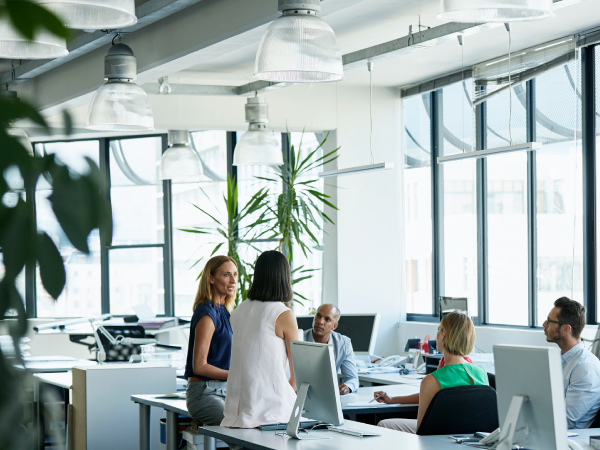
Identify the location of lights. (178, 162), (262, 151), (299, 62), (124, 108), (105, 9), (36, 47), (480, 12).